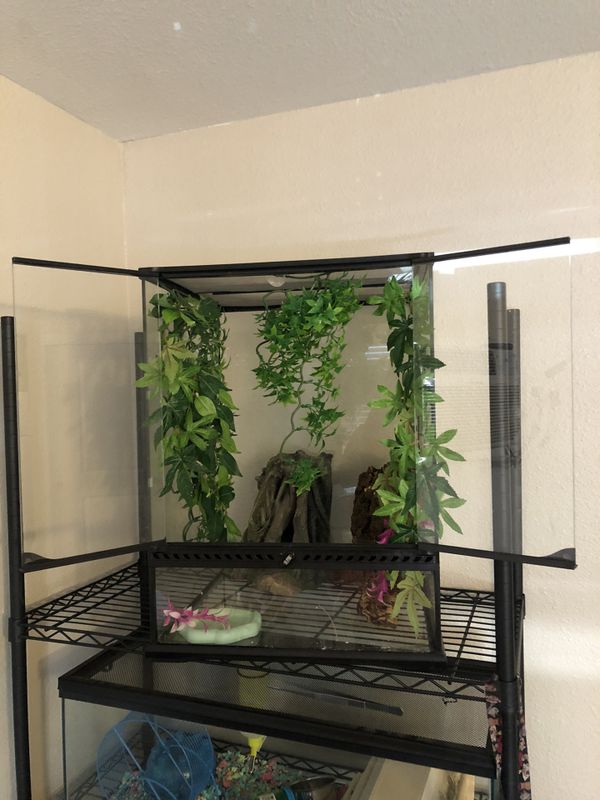
This screenshot has height=800, width=600. In order to click on light in this screenshot , I will do `click(584, 242)`.